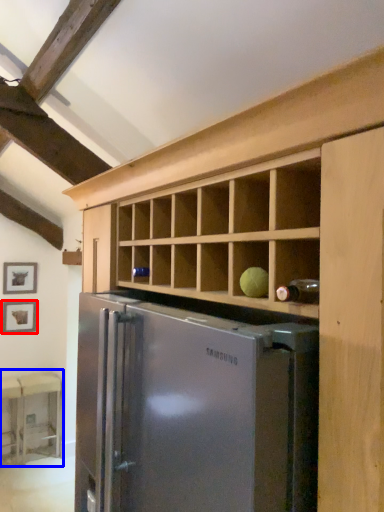
Question: Among these objects, which one is nearest to the camera, picture frame (highlighted by a red box) or table (highlighted by a blue box)?

Choices:
 (A) picture frame
 (B) table

Answer: (B)